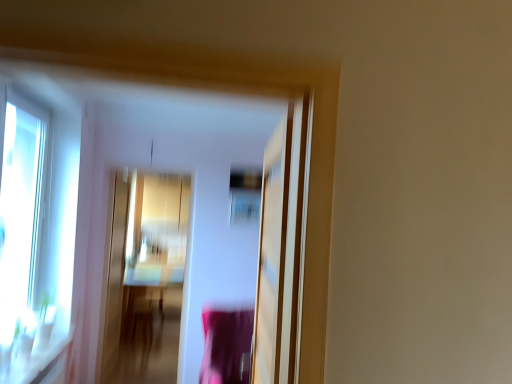
Question: Is transparent glass window at left situated inside transparent glass screen door at center, which appears as the 1th screen door when viewed from the front, or outside?

Choices:
 (A) inside
 (B) outside

Answer: (B)

Question: Is point (16, 135) positioned closer to the camera than point (274, 382)?

Choices:
 (A) closer
 (B) farther

Answer: (B)

Question: Based on their relative distances, which object is farther from the transparent glass screen door at center, which is counted as the 1th screen door, starting from the right?

Choices:
 (A) wooden table at center
 (B) gold metallic screen door at center, which is counted as the second screen door, starting from the front
 (C) transparent glass window at left

Answer: (A)

Question: Which is farther from the transparent glass window at left?

Choices:
 (A) gold metallic screen door at center, which is the 1th screen door in left-to-right order
 (B) transparent glass screen door at center, acting as the second screen door starting from the left
 (C) wooden table at center

Answer: (C)